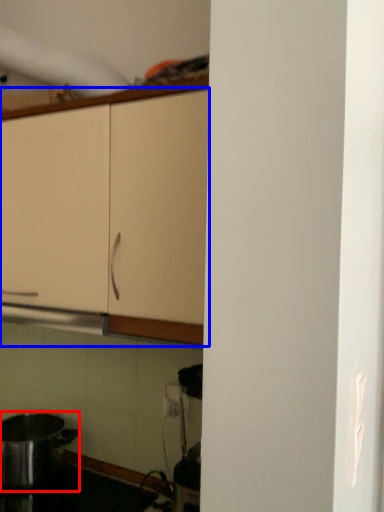
Question: Which point is closer to the camera, kitchen appliance (highlighted by a red box) or cabinetry (highlighted by a blue box)?

Choices:
 (A) kitchen appliance
 (B) cabinetry

Answer: (B)